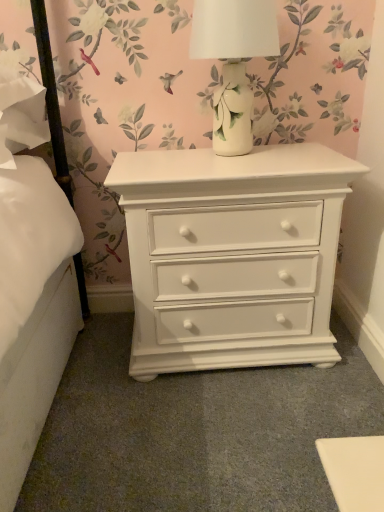
Question: Is white ceramic vase at upper center inside the boundaries of white painted wood nightstand at center, or outside?

Choices:
 (A) outside
 (B) inside

Answer: (A)

Question: In terms of height, does white ceramic vase at upper center look taller or shorter compared to white painted wood nightstand at center?

Choices:
 (A) short
 (B) tall

Answer: (A)

Question: From the image's perspective, is white ceramic vase at upper center positioned above or below white painted wood nightstand at center?

Choices:
 (A) above
 (B) below

Answer: (A)

Question: Is white painted wood nightstand at center inside the boundaries of white ceramic vase at upper center, or outside?

Choices:
 (A) outside
 (B) inside

Answer: (A)

Question: Is white painted wood nightstand at center to the left or to the right of white ceramic vase at upper center in the image?

Choices:
 (A) left
 (B) right

Answer: (B)

Question: In the image, is white painted wood nightstand at center positioned in front of or behind white ceramic vase at upper center?

Choices:
 (A) front
 (B) behind

Answer: (B)

Question: In terms of width, does white painted wood nightstand at center look wider or thinner when compared to white ceramic vase at upper center?

Choices:
 (A) thin
 (B) wide

Answer: (B)